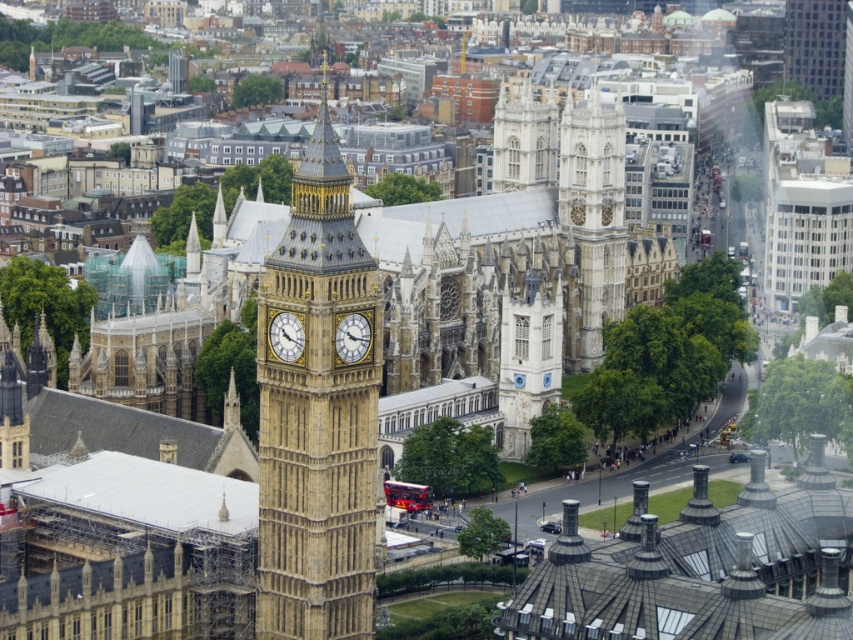
Based on the provided image, what are the coordinates of the golden stone clock tower at center?

The golden stone clock tower at center is located at coordinates point (318, 416).

You are a tourist standing on the street near the golden stone clock tower at center and the gold metallic clock at center. You want to take a photo that includes both objects in the frame. Which object should you focus on to ensure both are visible?

To include both the golden stone clock tower at center and the gold metallic clock at center in your photo, focus on the golden stone clock tower at center since it is positioned over the gold metallic clock at center, meaning it is closer to you and can be framed alongside the other object.

You are a drone operator trying to navigate between two points in the city. You see the point at coordinates point (262, 461) and point (357, 348). Which point is closer to your current position?

Point (262, 461) is further to the viewer than point (357, 348), so the point at (357, 348) is closer to your current position.